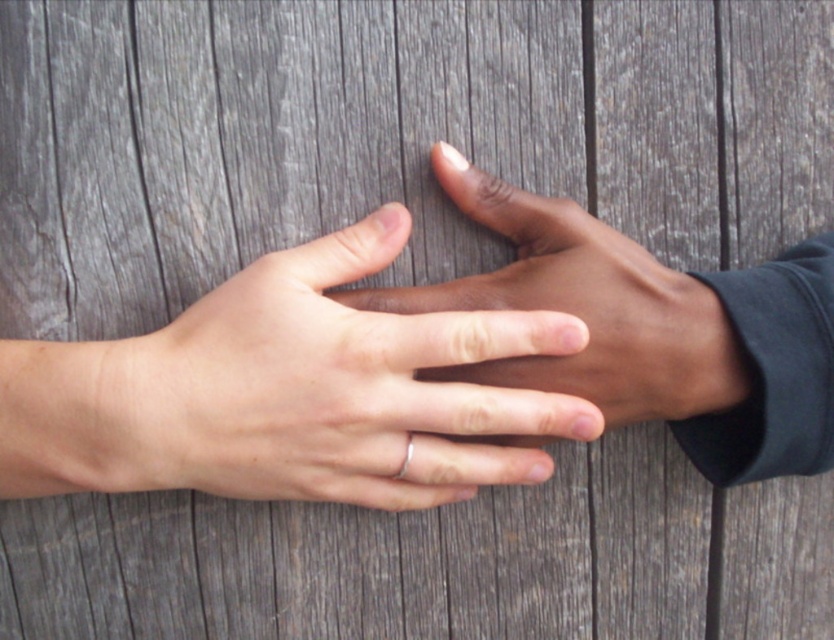
You are an artist trying to paint the scene. You notice the smooth skin hand at center and the silver metallic ring at center. Which object should you draw first if you want to follow the size order from largest to smallest?

The smooth skin hand at center has a larger size compared to the silver metallic ring at center, so you should draw the smooth skin hand at center first.

You are an app developer designing an accessibility feature that requires identifying the central point between two hands in an image. Given the coordinates of the matte silver ring at center, which is marked as point (x=339, y=387), can you confirm if this point lies exactly at the midpoint between the two hands?

The matte silver ring at center is represented by point (x=339, y=387), so this point is the midpoint between the two hands.

You are an artist sketching the scene and want to ensure accurate spatial relationships. Which object is positioned to the left of the other between the smooth skin hand at center and the silver metallic ring at center?

The silver metallic ring at center is positioned to the left of the smooth skin hand at center.